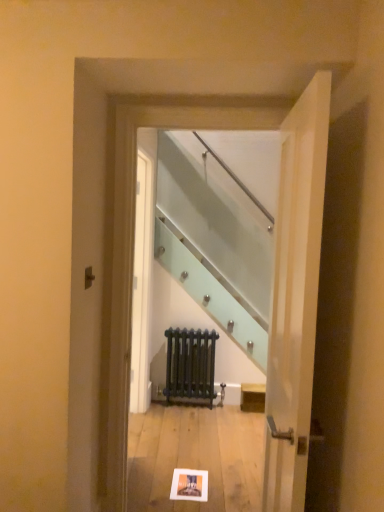
This screenshot has width=384, height=512. Identify the location of white paper postcard at center. (189, 485).

Where is `white wood door at right`? white wood door at right is located at coordinates (295, 297).

In the scene shown: Could you tell me if white paper postcard at center is facing matte black radiator at center?

No, white paper postcard at center is not aimed at matte black radiator at center.

Is point (200, 478) behind point (165, 388)?

No.

Measure the distance from white paper postcard at center to matte black radiator at center.

They are 3.89 feet apart.

Considering the sizes of white paper postcard at center and matte black radiator at center in the image, is white paper postcard at center wider or thinner than matte black radiator at center?

white paper postcard at center is wider than matte black radiator at center.

In the scene shown: Between white wood door at right and matte black radiator at center, which one appears on the right side from the viewer's perspective?

Positioned to the right is white wood door at right.

Is white wood door at right with matte black radiator at center?

No, white wood door at right is not making contact with matte black radiator at center.

Which is behind, point (272, 483) or point (201, 341)?

Positioned behind is point (201, 341).

Can you confirm if white wood door at right is smaller than matte black radiator at center?

Incorrect, white wood door at right is not smaller in size than matte black radiator at center.

Is white paper postcard at center closer to camera compared to white wood door at right?

No, it is not.

Measure the distance from white paper postcard at center to white wood door at right.

white paper postcard at center is 3.93 feet away from white wood door at right.

In the scene shown: Is white paper postcard at center at the left side of white wood door at right?

Yes, white paper postcard at center is to the left of white wood door at right.

Is white paper postcard at center next to white wood door at right?

No.

Is white paper postcard at center aimed at clear glass staircase at center?

No, white paper postcard at center is not turned towards clear glass staircase at center.

From their relative heights in the image, would you say white paper postcard at center is taller or shorter than clear glass staircase at center?

white paper postcard at center is shorter than clear glass staircase at center.

Is white paper postcard at center placed right next to clear glass staircase at center?

white paper postcard at center and clear glass staircase at center are clearly separated.

Does point (186, 489) come behind point (129, 157)?

Yes, point (186, 489) is behind point (129, 157).

From the image's perspective, is matte black radiator at center positioned above or below white wood door at right?

matte black radiator at center is situated lower than white wood door at right in the image.

Considering the relative sizes of matte black radiator at center and white wood door at right in the image provided, is matte black radiator at center taller than white wood door at right?

In fact, matte black radiator at center may be shorter than white wood door at right.

Is point (196, 331) positioned in front of point (284, 447)?

No, it is not.

Does matte black radiator at center lie in front of clear glass staircase at center?

No, it is not.

Looking at this image, which of these two, matte black radiator at center or clear glass staircase at center, is smaller?

matte black radiator at center.

Could you tell me if matte black radiator at center is facing clear glass staircase at center?

Yes, matte black radiator at center faces towards clear glass staircase at center.

How different are the orientations of matte black radiator at center and clear glass staircase at center in degrees?

They differ by 0.0574 degrees in their facing directions.

In the scene shown: From the image's perspective, which is below, clear glass staircase at center or white paper postcard at center?

From the image's view, white paper postcard at center is below.

Based on their sizes in the image, would you say clear glass staircase at center is bigger or smaller than white paper postcard at center?

In the image, clear glass staircase at center appears to be larger than white paper postcard at center.

The height and width of the screenshot is (512, 384). In the image, there is a white paper postcard at center. Identify the location of glass door above it (from the image's perspective). (133, 249).

The width and height of the screenshot is (384, 512). Find the location of `postcard located in front of the matte black radiator at center`. postcard located in front of the matte black radiator at center is located at coordinates pyautogui.click(x=189, y=485).

The width and height of the screenshot is (384, 512). I want to click on door that appears on the right of matte black radiator at center, so click(295, 297).

From the image, which object appears to be farther from white paper postcard at center, white wood door at right or clear glass staircase at center?

white wood door at right.

Based on their spatial positions, is matte black radiator at center or white wood door at right further from clear glass staircase at center?

The object further to clear glass staircase at center is matte black radiator at center.

Considering their positions, is white paper postcard at center positioned closer to white wood door at right than clear glass staircase at center?

The object closer to white wood door at right is clear glass staircase at center.

Looking at the image, which one is located closer to white paper postcard at center, white wood door at right or matte black radiator at center?

matte black radiator at center is positioned closer to the anchor white paper postcard at center.

Estimate the real-world distances between objects in this image. Which object is further from matte black radiator at center, white wood door at right or white paper postcard at center?

white wood door at right.

From the image, which object appears to be farther from clear glass staircase at center, matte black radiator at center or white paper postcard at center?

matte black radiator at center is positioned further to the anchor clear glass staircase at center.

Which object lies further to the anchor point white wood door at right, matte black radiator at center or clear glass staircase at center?

Based on the image, matte black radiator at center appears to be further to white wood door at right.

Looking at the image, which one is located further to white paper postcard at center, clear glass staircase at center or white wood door at right?

Among the two, white wood door at right is located further to white paper postcard at center.

The height and width of the screenshot is (512, 384). In order to click on postcard located between white wood door at right and matte black radiator at center in the depth direction in this screenshot , I will do `click(189, 485)`.

Find the location of a particular element. This screenshot has height=512, width=384. glass door located between white wood door at right and white paper postcard at center in the depth direction is located at coordinates (133, 249).

You are a GUI agent. You are given a task and a screenshot of the screen. Output one action in this format:
    pyautogui.click(x=<x>, y=<y>)
    Task: Click on the postcard between clear glass staircase at center and matte black radiator at center along the z-axis
    The image size is (384, 512).
    Given the screenshot: What is the action you would take?
    pyautogui.click(x=189, y=485)

At what (x,y) coordinates should I click in order to perform the action: click on glass door between white wood door at right and matte black radiator at center in the front-back direction. Please return your answer as a coordinate pair (x, y). Looking at the image, I should click on [x=133, y=249].